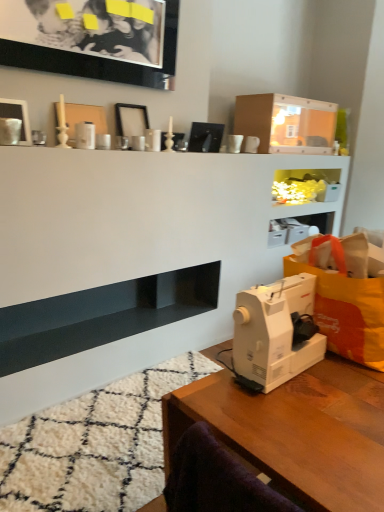
This screenshot has height=512, width=384. I want to click on blank space above white plastic sewing machine at lower right (from a real-world perspective), so click(x=280, y=281).